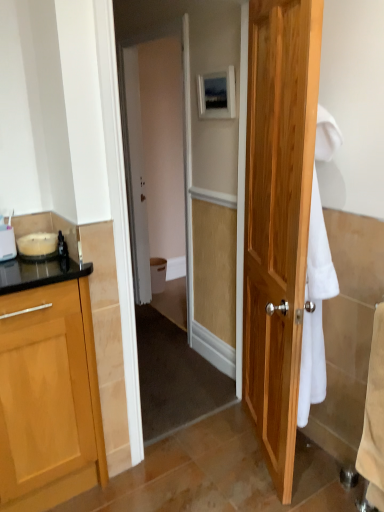
Image resolution: width=384 pixels, height=512 pixels. What do you see at coordinates (38, 246) in the screenshot?
I see `white glossy bowl at left` at bounding box center [38, 246].

Find the location of a particular element. This screenshot has width=384, height=512. white glossy bowl at left is located at coordinates (38, 246).

What are the coordinates of `white glossy bowl at left` in the screenshot? It's located at (38, 246).